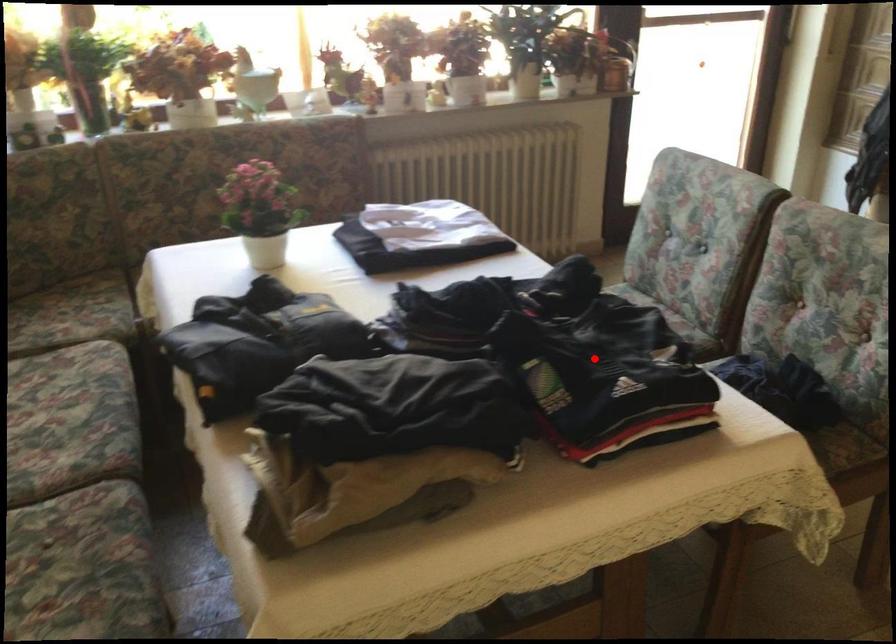
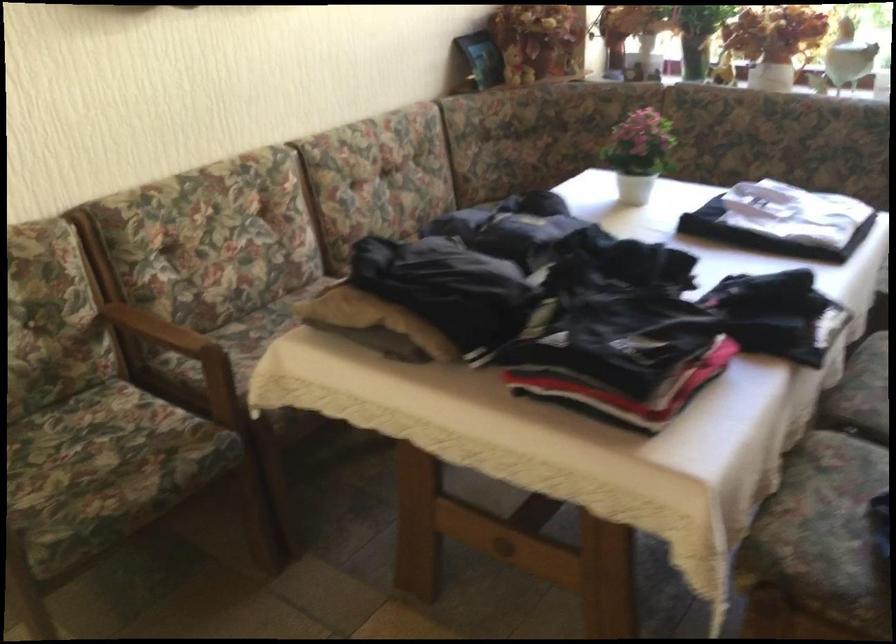
Find the pixel in the second image that matches the highlighted location in the first image.

(589, 317)